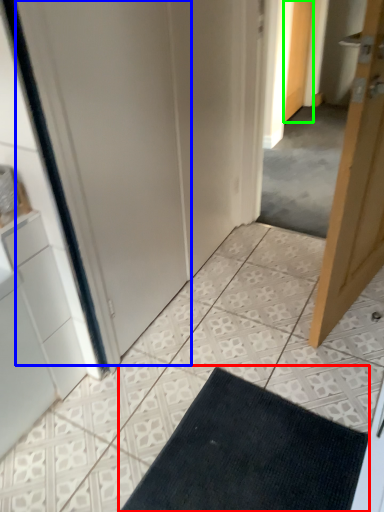
Question: Considering the real-world distances, which object is closest to bath mat (highlighted by a red box)? screen door (highlighted by a blue box) or door (highlighted by a green box).

Choices:
 (A) screen door
 (B) door

Answer: (A)